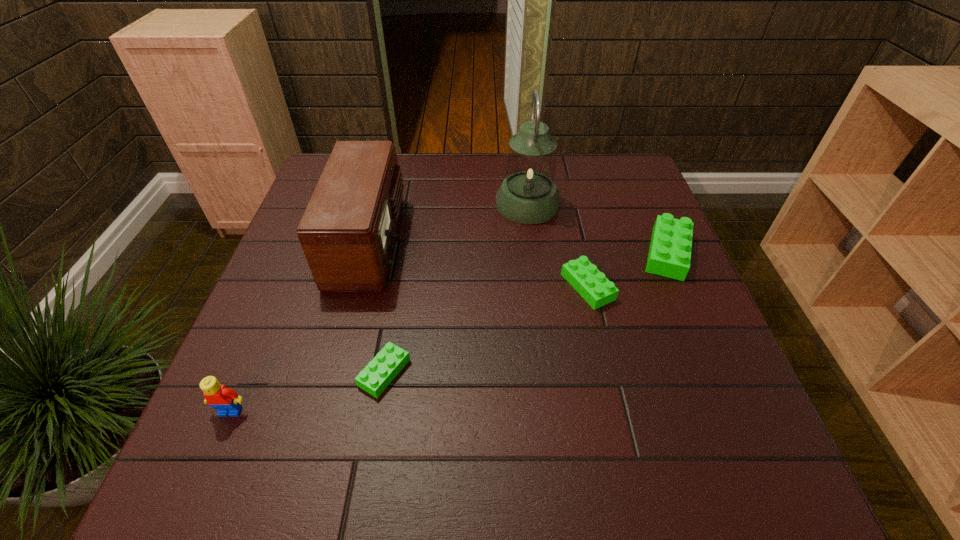
What are the coordinates of `the shortest object` in the screenshot? It's located at (384, 367).

What are the coordinates of `the shortest Lego` in the screenshot? It's located at (384, 367).

Identify the location of the third Lego from left to right. The width and height of the screenshot is (960, 540). (583, 276).

At what (x,y) coordinates should I click in order to perform the action: click on the second shortest Lego. Please return your answer as a coordinate pair (x, y). The image size is (960, 540). Looking at the image, I should click on (583, 276).

Identify the location of the rightmost Lego. The height and width of the screenshot is (540, 960). point(669,255).

Where is `the fourth tallest object`? This screenshot has height=540, width=960. the fourth tallest object is located at coordinates (669, 255).

This screenshot has height=540, width=960. I want to click on lantern, so click(528, 195).

Find the location of a particular element. The image size is (960, 540). radio receiver is located at coordinates (347, 232).

Where is `the third tallest object`? the third tallest object is located at coordinates pos(227,402).

The image size is (960, 540). I want to click on the leftmost Lego, so click(227, 402).